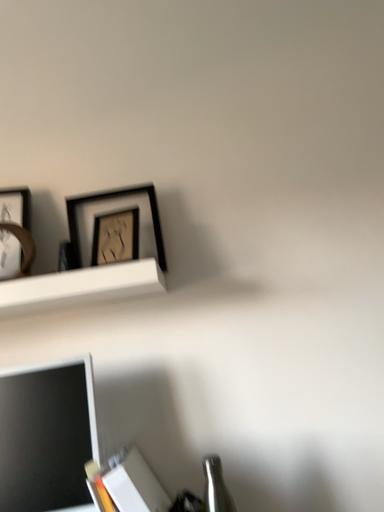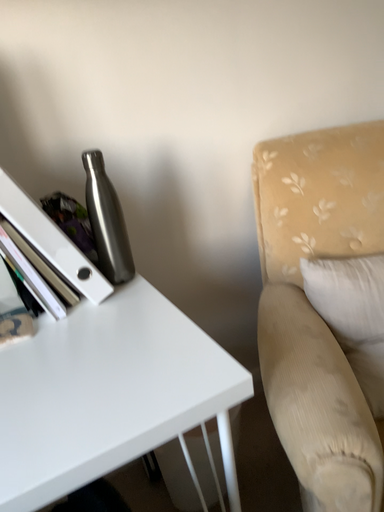
Question: Which way did the camera rotate in the video?

Choices:
 (A) rotated right
 (B) rotated left

Answer: (A)